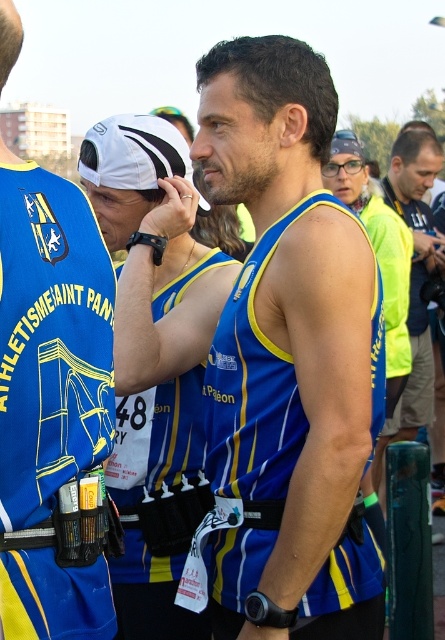
Is point (88, 388) positioned after point (181, 620)?

No, (88, 388) is closer to viewer.

Can you confirm if blue/yellow athletic vest at left is positioned to the right of blue/yellow athletic vest at center?

Incorrect, blue/yellow athletic vest at left is not on the right side of blue/yellow athletic vest at center.

This screenshot has height=640, width=445. In order to click on blue/yellow athletic vest at left in this screenshot , I will do `click(51, 340)`.

Does point (64, 609) come in front of point (420, 259)?

That is True.

Is blue/yellow athletic vest at left below yellow fabric vest at right?

Yes, blue/yellow athletic vest at left is below yellow fabric vest at right.

Does point (16, 500) come in front of point (396, 432)?

That is True.

Locate an element on the screen. Image resolution: width=445 pixels, height=640 pixels. blue/yellow athletic vest at left is located at coordinates (51, 340).

Can you confirm if blue/yellow athletic vest at center is taller than yellow fabric vest at right?

Incorrect, blue/yellow athletic vest at center's height is not larger of yellow fabric vest at right's.

What do you see at coordinates (157, 506) in the screenshot? Image resolution: width=445 pixels, height=640 pixels. I see `blue/yellow athletic vest at center` at bounding box center [157, 506].

The width and height of the screenshot is (445, 640). In order to click on blue/yellow athletic vest at center in this screenshot , I will do coord(157,506).